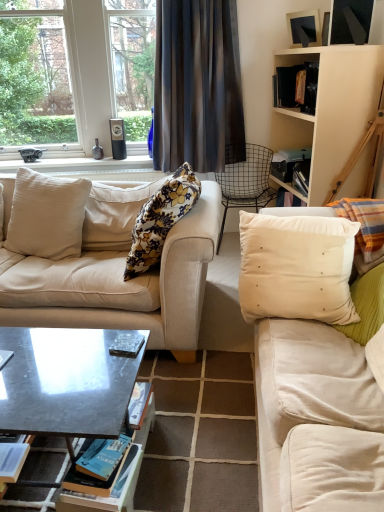
Question: Considering the relative sizes of hardcover book at center, the 2th book when ordered from right to left, and floral fabric pillow at center, the 3th pillow positioned from the right, in the image provided, is hardcover book at center, the 2th book when ordered from right to left, shorter than floral fabric pillow at center, the 3th pillow positioned from the right,?

Choices:
 (A) yes
 (B) no

Answer: (A)

Question: Can you confirm if hardcover book at center, the 2th book when ordered from right to left, is taller than floral fabric pillow at center, the 3th pillow positioned from the right?

Choices:
 (A) no
 (B) yes

Answer: (A)

Question: Is hardcover book at center, the second book from the left, bigger than floral fabric pillow at center, which appears as the second pillow when viewed from the left?

Choices:
 (A) yes
 (B) no

Answer: (B)

Question: Can you confirm if hardcover book at center, arranged as the 3th book when viewed from the top, is smaller than floral fabric pillow at center, which appears as the second pillow when viewed from the left?

Choices:
 (A) yes
 (B) no

Answer: (A)

Question: Is hardcover book at center, arranged as the 3th book when viewed from the top, closer to the viewer compared to floral fabric pillow at center, which appears as the second pillow when viewed from the left?

Choices:
 (A) no
 (B) yes

Answer: (B)

Question: Considering the positions of metallic silver picture frame at upper right and beige fabric pillow at left, the 4th pillow when ordered from right to left, in the image, is metallic silver picture frame at upper right bigger or smaller than beige fabric pillow at left, the 4th pillow when ordered from right to left,?

Choices:
 (A) big
 (B) small

Answer: (B)

Question: In terms of width, does metallic silver picture frame at upper right look wider or thinner when compared to beige fabric pillow at left, the 1th pillow positioned from the left?

Choices:
 (A) wide
 (B) thin

Answer: (B)

Question: Considering the relative positions of metallic silver picture frame at upper right and beige fabric pillow at left, the 4th pillow when ordered from right to left, in the image provided, is metallic silver picture frame at upper right to the left or to the right of beige fabric pillow at left, the 4th pillow when ordered from right to left,?

Choices:
 (A) left
 (B) right

Answer: (B)

Question: Is point (302, 32) closer or farther from the camera than point (23, 211)?

Choices:
 (A) farther
 (B) closer

Answer: (A)

Question: Does point (79, 223) appear closer or farther from the camera than point (119, 169)?

Choices:
 (A) farther
 (B) closer

Answer: (B)

Question: Looking at the image, does beige fabric pillow at left, the 1th pillow positioned from the left, seem bigger or smaller compared to matte black speaker at upper left?

Choices:
 (A) small
 (B) big

Answer: (B)

Question: Is beige fabric pillow at left, the 4th pillow when ordered from right to left, inside or outside of matte black speaker at upper left?

Choices:
 (A) inside
 (B) outside

Answer: (B)

Question: In terms of width, does beige fabric pillow at left, the 1th pillow positioned from the left, look wider or thinner when compared to matte black speaker at upper left?

Choices:
 (A) wide
 (B) thin

Answer: (A)

Question: Is point (142, 158) closer or farther from the camera than point (236, 151)?

Choices:
 (A) closer
 (B) farther

Answer: (B)

Question: Considering the relative positions of matte black speaker at upper left and wire mesh chair at center in the image provided, is matte black speaker at upper left to the left or to the right of wire mesh chair at center?

Choices:
 (A) right
 (B) left

Answer: (B)